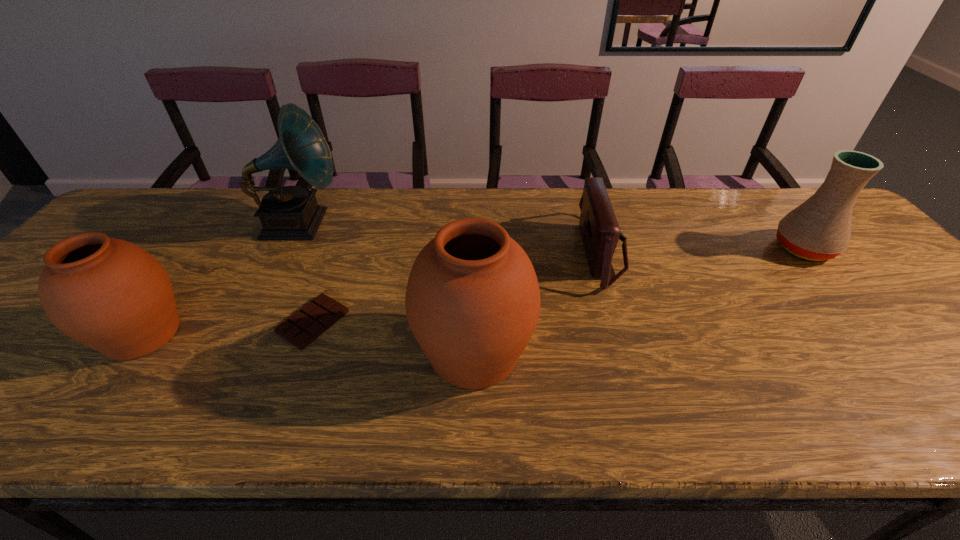
Where is `object that is at the far right corner`? The image size is (960, 540). object that is at the far right corner is located at coordinates tap(819, 229).

This screenshot has height=540, width=960. In order to click on free spot at the far edge of the desktop in this screenshot , I will do `click(716, 231)`.

In the image, there is a desktop. Find the location of `vacant space at the near edge`. vacant space at the near edge is located at coordinates (564, 369).

This screenshot has width=960, height=540. I want to click on free space at the right edge, so click(875, 297).

In the image, there is a desktop. At what (x,y) coordinates should I click in order to perform the action: click on vacant area at the far left corner. Please return your answer as a coordinate pair (x, y). This screenshot has height=540, width=960. Looking at the image, I should click on (122, 216).

Where is `free space between the pottery and the phonograph_record`? The image size is (960, 540). free space between the pottery and the phonograph_record is located at coordinates (552, 236).

Image resolution: width=960 pixels, height=540 pixels. Identify the location of vacant space that is in between the candy bar and the rightmost object. (559, 285).

At what (x,y) coordinates should I click in order to perform the action: click on unoccupied area between the rightmost object and the taller urn. Please return your answer as a coordinate pair (x, y). This screenshot has height=540, width=960. Looking at the image, I should click on (638, 301).

What are the coordinates of `object that ranks as the closest to the rightmost object` in the screenshot? It's located at (600, 231).

Locate an element on the screen. object identified as the closest to the shortest object is located at coordinates coord(472,300).